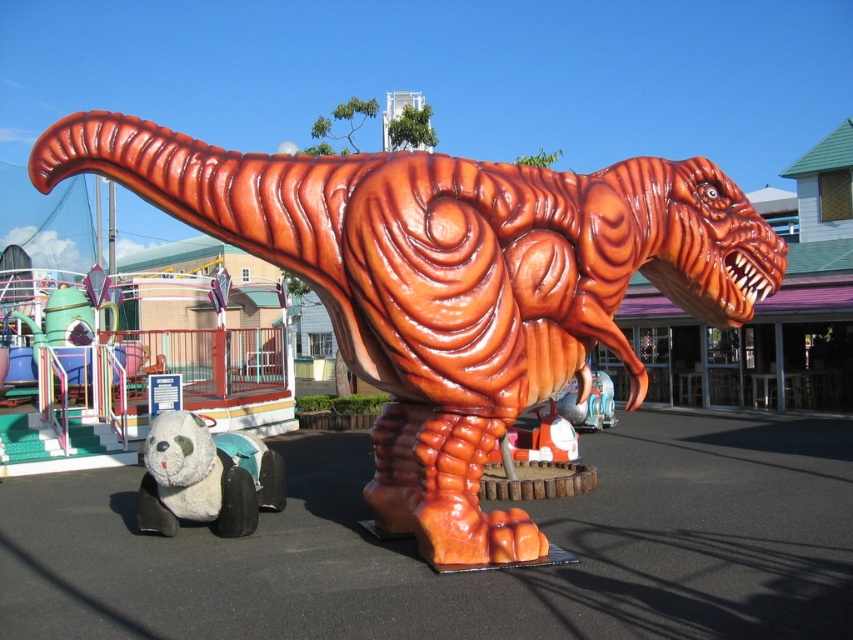
Which is in front, point (198, 154) or point (178, 424)?

Point (198, 154)

Looking at this image, who is shorter, shiny orange dinosaur at center or white plush panda at lower left?

white plush panda at lower left is shorter.

Is point (561, 333) in front of point (193, 492)?

Yes, point (561, 333) is in front of point (193, 492).

The image size is (853, 640). What are the coordinates of `shiny orange dinosaur at center` in the screenshot? It's located at click(x=451, y=284).